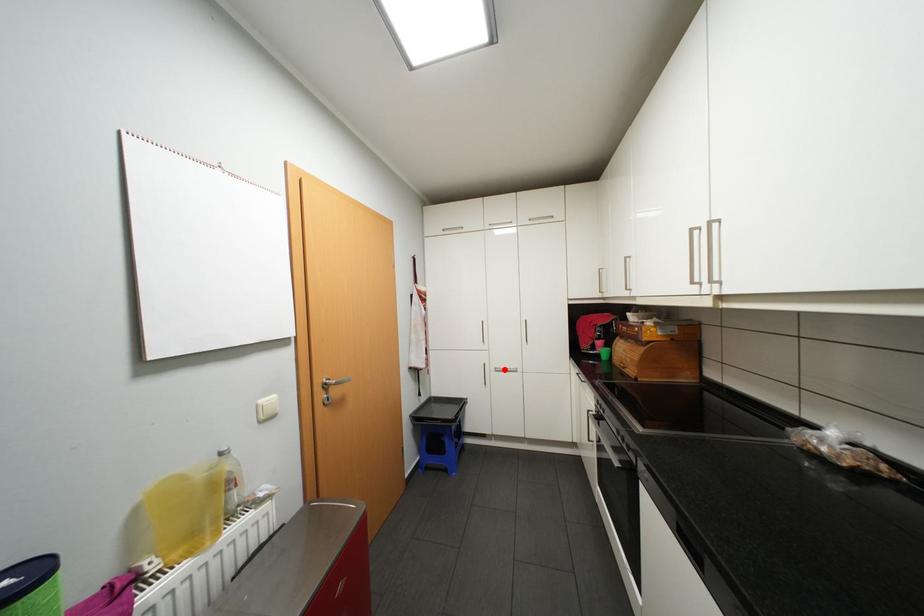
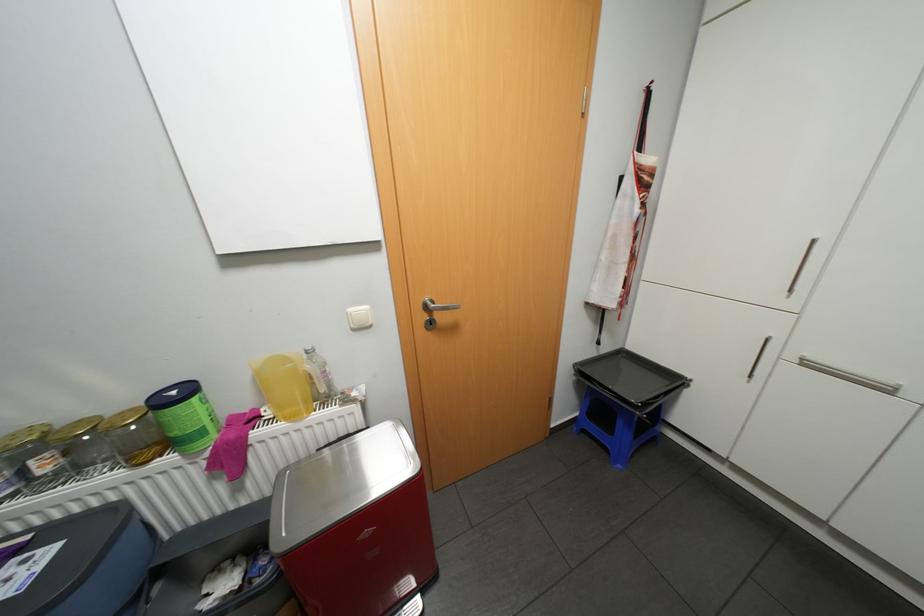
Find the pixel in the second image that matches the highlighted location in the first image.

(813, 363)